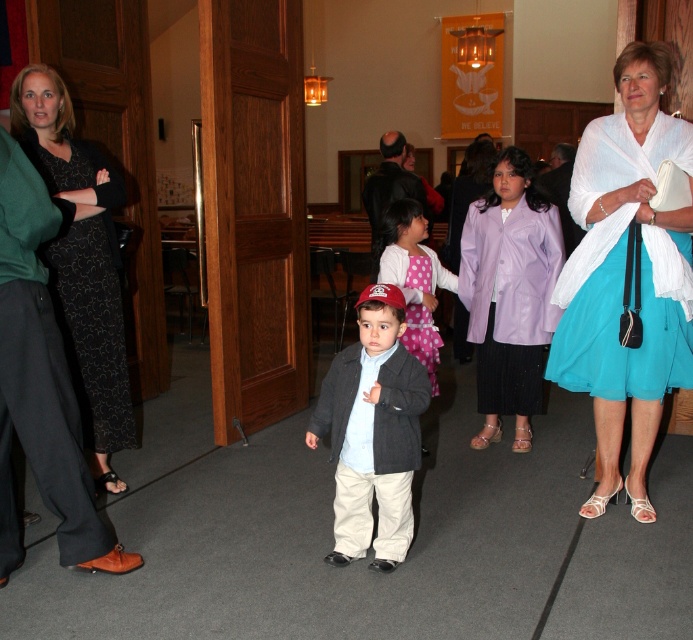
Is white textured shawl at upper right thinner than lavender satin blazer at center?

No, white textured shawl at upper right is not thinner than lavender satin blazer at center.

Locate an element on the screen. The image size is (693, 640). white textured shawl at upper right is located at coordinates (622, 275).

Where is `white textured shawl at upper right`? This screenshot has width=693, height=640. white textured shawl at upper right is located at coordinates (622, 275).

Who is more forward, (346, 513) or (89, 364)?

Point (346, 513) is in front.

Can you confirm if matte gray jacket at center is wider than black printed fabric dress at left?

Correct, the width of matte gray jacket at center exceeds that of black printed fabric dress at left.

Find the location of a particular element. The width and height of the screenshot is (693, 640). matte gray jacket at center is located at coordinates (371, 433).

Is black printed fabric dress at left wider than pink polka dot dress at center?

Yes.

Can you confirm if black printed fabric dress at left is taller than pink polka dot dress at center?

Yes.

What do you see at coordinates (87, 292) in the screenshot?
I see `black printed fabric dress at left` at bounding box center [87, 292].

Where is `black printed fabric dress at left`? The height and width of the screenshot is (640, 693). black printed fabric dress at left is located at coordinates (87, 292).